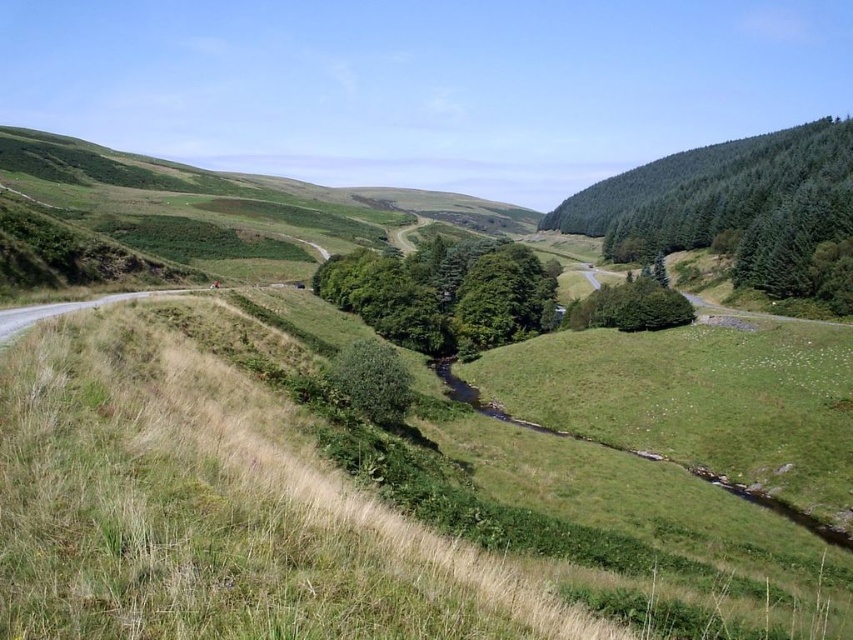
Question: Among these objects, which one is farthest from the camera?

Choices:
 (A) green leafy bush at center
 (B) green leafy tree at center
 (C) green grassy hillside at upper left

Answer: (B)

Question: Which of the following is the farthest from the observer?

Choices:
 (A) (111, 518)
 (B) (428, 272)
 (C) (366, 394)

Answer: (B)

Question: In this image, where is green coniferous forest at upper right located relative to green leafy tree at center?

Choices:
 (A) above
 (B) below

Answer: (A)

Question: Does green coniferous forest at upper right have a lesser width compared to green leafy bush at center?

Choices:
 (A) no
 (B) yes

Answer: (A)

Question: Can you confirm if green leafy tree at center is wider than green leafy bush at center?

Choices:
 (A) no
 (B) yes

Answer: (B)

Question: Which object is farther from the camera taking this photo?

Choices:
 (A) green grassy hillside at upper left
 (B) green coniferous forest at upper right
 (C) green leafy bush at center

Answer: (B)